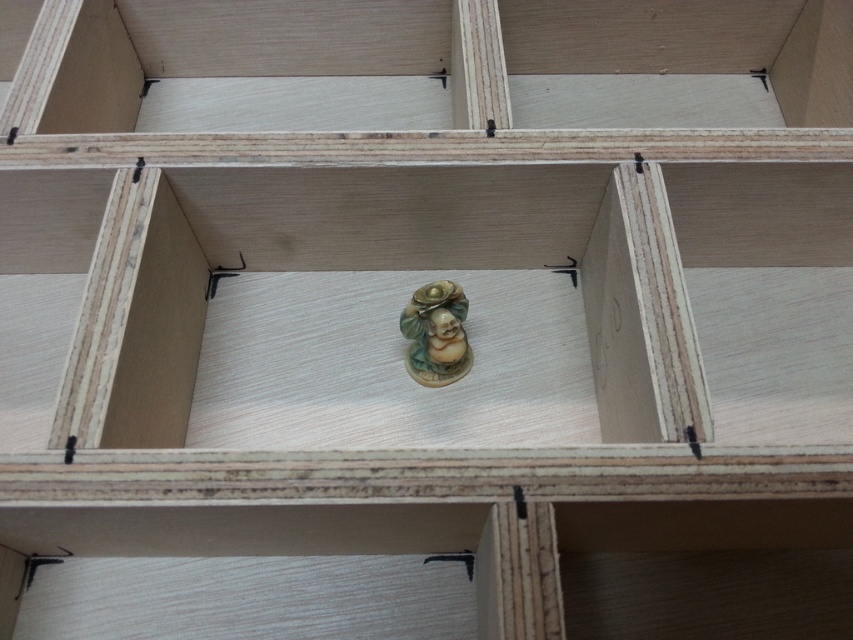
Question: Does matte ceramic statue at center have a greater width compared to matte ceramic figurine at center?

Choices:
 (A) yes
 (B) no

Answer: (A)

Question: Can you confirm if matte ceramic statue at center is positioned to the left of matte ceramic figurine at center?

Choices:
 (A) no
 (B) yes

Answer: (B)

Question: Which point is closer to the camera?

Choices:
 (A) matte ceramic figurine at center
 (B) matte ceramic statue at center

Answer: (B)

Question: Which object is closer to the camera taking this photo?

Choices:
 (A) matte ceramic figurine at center
 (B) matte ceramic statue at center

Answer: (B)

Question: Among these points, which one is farthest from the camera?

Choices:
 (A) (172, 380)
 (B) (415, 348)

Answer: (B)

Question: Does matte ceramic statue at center lie in front of matte ceramic figurine at center?

Choices:
 (A) yes
 (B) no

Answer: (A)